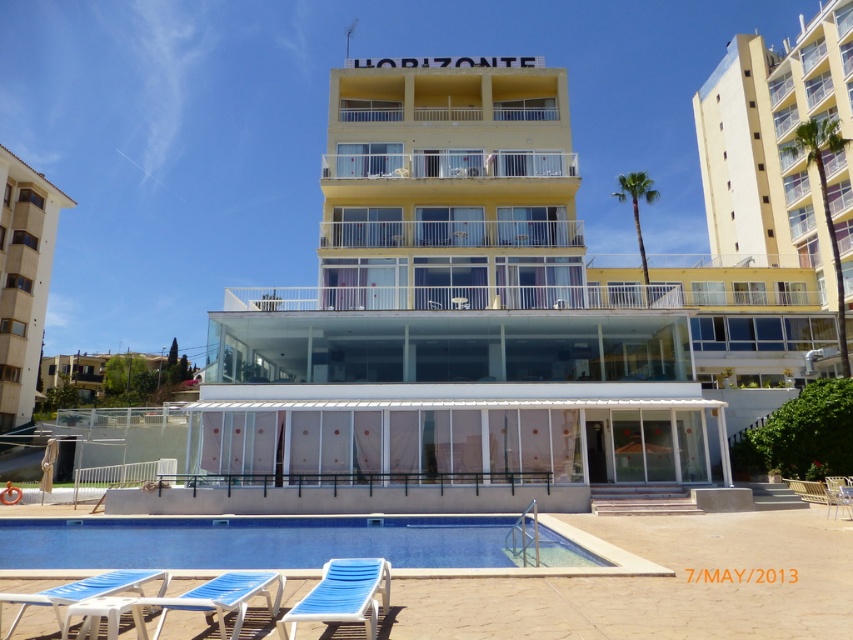
Question: Does blue woven beach chair at lower center have a greater width compared to blue fabric lounge chair at lower left?

Choices:
 (A) yes
 (B) no

Answer: (B)

Question: Estimate the real-world distances between objects in this image. Which object is farther from the metallic silver beach chair at lower right?

Choices:
 (A) yellow matte building at upper right
 (B) yellow matte building at center

Answer: (A)

Question: Can you confirm if blue woven beach chair at lower center is smaller than metallic silver beach chair at lower right?

Choices:
 (A) yes
 (B) no

Answer: (A)

Question: Which object is farther from the camera taking this photo?

Choices:
 (A) blue smooth pool at center
 (B) yellow matte building at upper right
 (C) beige concrete building at left
 (D) metallic silver beach chair at lower right

Answer: (C)

Question: Which point is farther from the camera taking this photo?

Choices:
 (A) (573, 262)
 (B) (57, 612)
 (C) (834, 500)
 (D) (339, 592)

Answer: (A)

Question: Does yellow matte building at upper right appear under blue smooth pool at center?

Choices:
 (A) no
 (B) yes

Answer: (A)